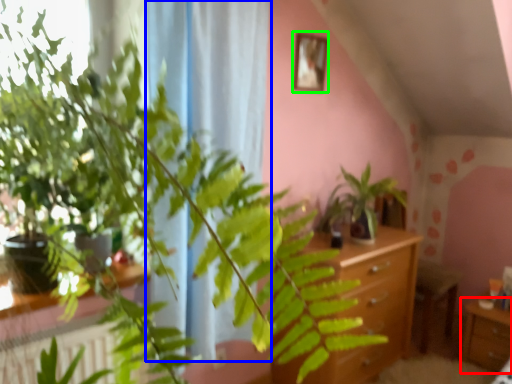
Question: Estimate the real-world distances between objects in this image. Which object is farther from table (highlighted by a red box), curtain (highlighted by a blue box) or picture frame (highlighted by a green box)?

Choices:
 (A) curtain
 (B) picture frame

Answer: (A)